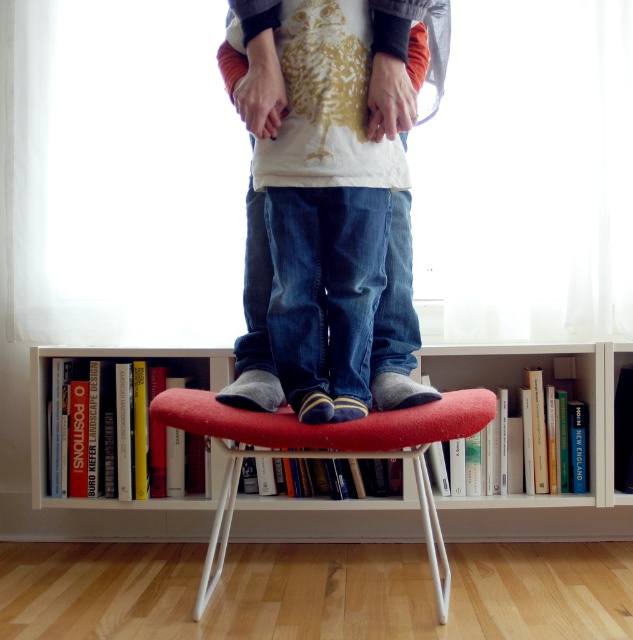
Who is positioned more to the right, red fabric stool at center or denim jeans at center?

From the viewer's perspective, red fabric stool at center appears more on the right side.

Who is taller, red fabric stool at center or denim jeans at center?

With more height is denim jeans at center.

Is point (334, 458) closer to viewer compared to point (260, 388)?

That is False.

The image size is (633, 640). In order to click on red fabric stool at center in this screenshot , I will do `click(323, 456)`.

Does white wood bookcase at center have a smaller size compared to denim jeans at center?

No, white wood bookcase at center is not smaller than denim jeans at center.

Which of these two, white wood bookcase at center or denim jeans at center, stands shorter?

white wood bookcase at center is shorter.

Where is `white wood bookcase at center`? white wood bookcase at center is located at coordinates (589, 444).

Find the location of a particular element. The width and height of the screenshot is (633, 640). white wood bookcase at center is located at coordinates (x=589, y=444).

Can you confirm if white wood bookcase at center is taller than red fabric stool at center?

Yes.

Does white wood bookcase at center appear over red fabric stool at center?

Indeed, white wood bookcase at center is positioned over red fabric stool at center.

This screenshot has height=640, width=633. I want to click on white wood bookcase at center, so click(x=589, y=444).